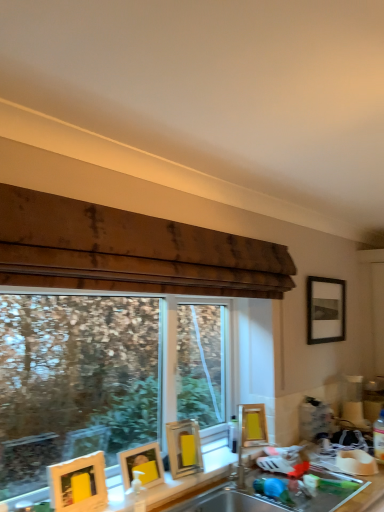
Find the location of a particular element. Image resolution: width=384 pixels, height=512 pixels. vacant space that is in between matte gold picture frame at lower left, marked as the fourth picture frame in a back-to-front arrangement, and yellow matte picture frame at lower center, which is counted as the 3th picture frame, starting from the back is located at coordinates (173, 480).